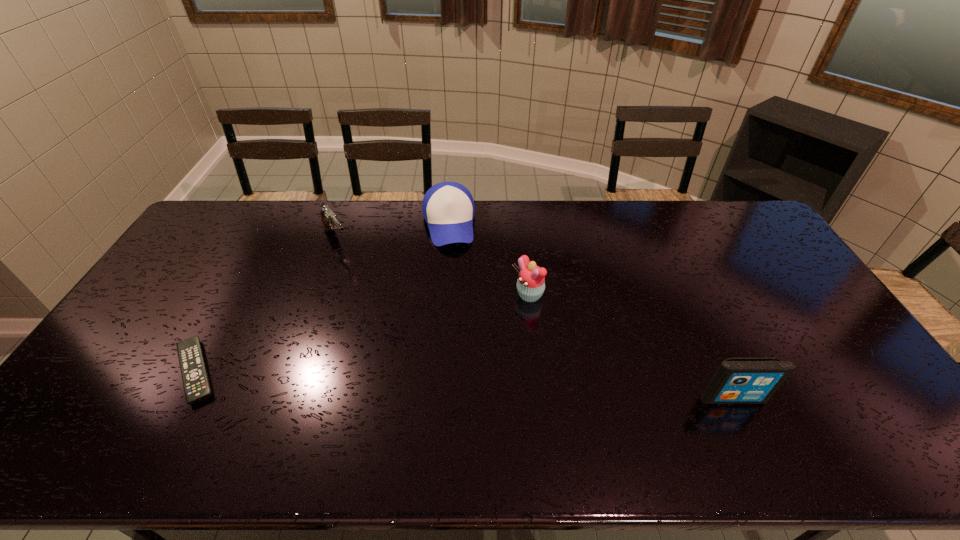
The height and width of the screenshot is (540, 960). I want to click on vacant area that lies between the cupcake and the baseball cap, so click(488, 260).

This screenshot has width=960, height=540. What are the coordinates of `empty space between the fourth object from right to left and the third nearest object` in the screenshot? It's located at (433, 268).

What are the coordinates of `vacant space that is in between the third farthest object and the baseball cap` in the screenshot? It's located at (488, 260).

Find the location of `empty location between the iPod and the third object from left to right`. empty location between the iPod and the third object from left to right is located at coordinates (590, 311).

The image size is (960, 540). Find the location of `free space between the baseball cap and the pistol`. free space between the baseball cap and the pistol is located at coordinates (393, 232).

Where is `empty space that is in between the third farthest object and the baseball cap`? The image size is (960, 540). empty space that is in between the third farthest object and the baseball cap is located at coordinates (488, 260).

Identify the location of free point between the remote control and the baseball cap. (322, 298).

Where is `free area in between the shortest object and the pistol`? free area in between the shortest object and the pistol is located at coordinates (267, 306).

The image size is (960, 540). I want to click on the third closest object to the cupcake, so click(329, 219).

Locate an element on the screen. The image size is (960, 540). object that is the third nearest to the iPod is located at coordinates (329, 219).